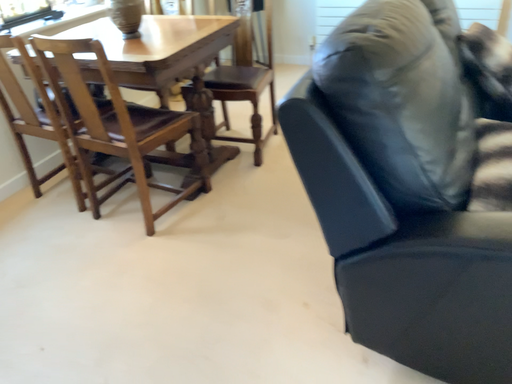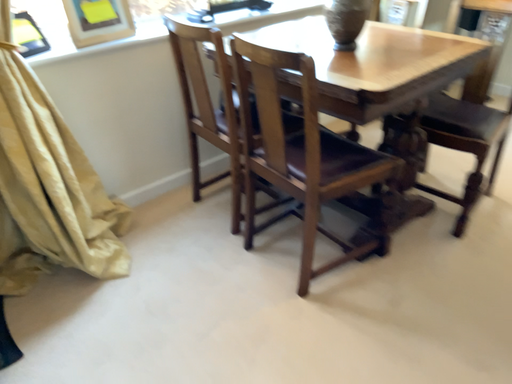
Question: Which way did the camera rotate in the video?

Choices:
 (A) rotated right
 (B) rotated left

Answer: (B)